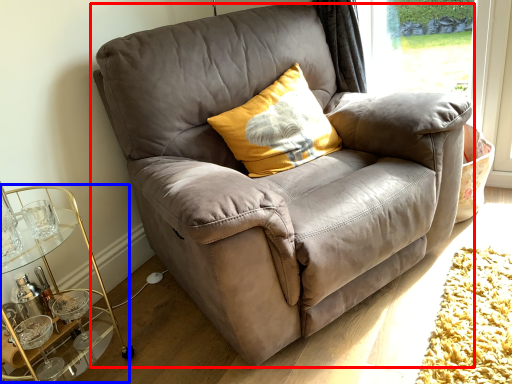
Question: Which object is further to the camera taking this photo, chair (highlighted by a red box) or cocktail table (highlighted by a blue box)?

Choices:
 (A) chair
 (B) cocktail table

Answer: (B)